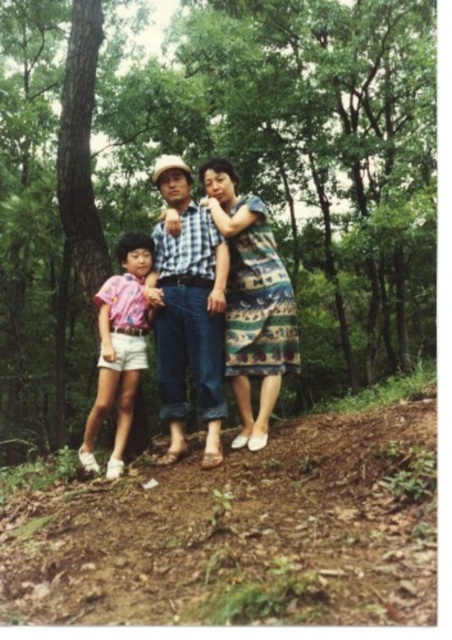
How much distance is there between matte blue jeans at center and checkered fabric shirt at center?

matte blue jeans at center and checkered fabric shirt at center are 4.47 inches apart from each other.

Does matte blue jeans at center have a lesser width compared to checkered fabric shirt at center?

No.

Does point (252, 422) lie in front of point (207, 298)?

That is True.

I want to click on matte blue jeans at center, so click(x=217, y=305).

Can you confirm if matte blue jeans at center is positioned below pink cotton shorts at lower left?

Incorrect, matte blue jeans at center is not positioned below pink cotton shorts at lower left.

Does matte blue jeans at center have a greater width compared to pink cotton shorts at lower left?

Correct, the width of matte blue jeans at center exceeds that of pink cotton shorts at lower left.

Does point (98, 296) come closer to viewer compared to point (104, 304)?

Yes.

Locate an element on the screen. Image resolution: width=452 pixels, height=640 pixels. matte blue jeans at center is located at coordinates (217, 305).

Which of these two, checkered fabric shirt at center or patterned fabric dress at center, stands shorter?

Standing shorter between the two is patterned fabric dress at center.

Looking at this image, can you confirm if checkered fabric shirt at center is positioned to the left of patterned fabric dress at center?

Correct, you'll find checkered fabric shirt at center to the left of patterned fabric dress at center.

The image size is (452, 640). Identify the location of checkered fabric shirt at center. (188, 310).